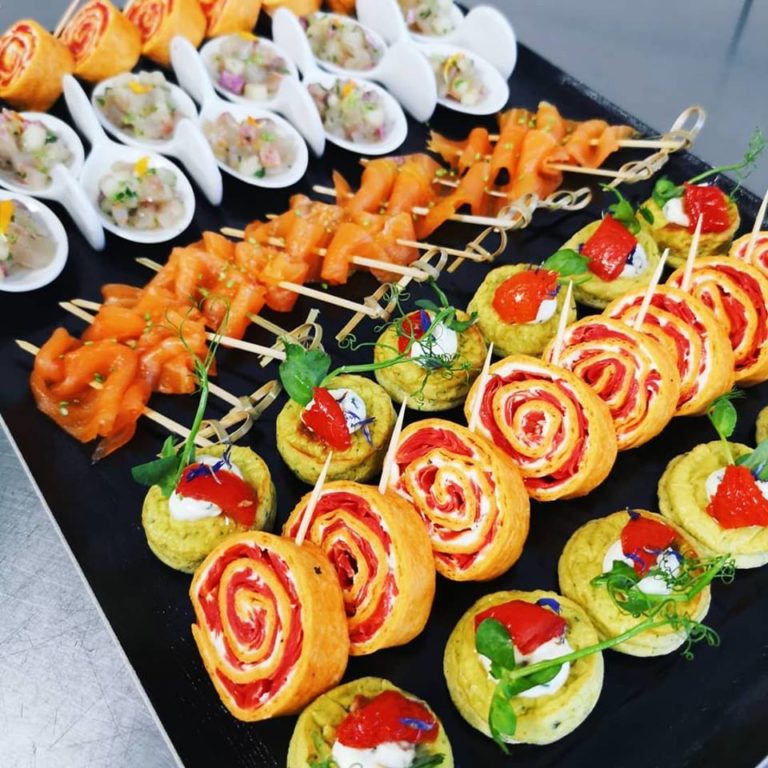
The height and width of the screenshot is (768, 768). Identify the location of out of focus food item in flat white spoon. (41, 224), (71, 144), (144, 161), (151, 96), (255, 133), (256, 71), (349, 93), (349, 40), (462, 80), (428, 12).